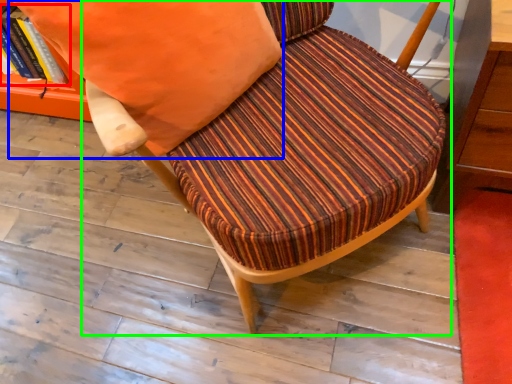
Question: Based on their relative distances, which object is farther from book (highlighted by a red box)? Choose from throw pillow (highlighted by a blue box) and chair (highlighted by a green box).

Choices:
 (A) throw pillow
 (B) chair

Answer: (B)